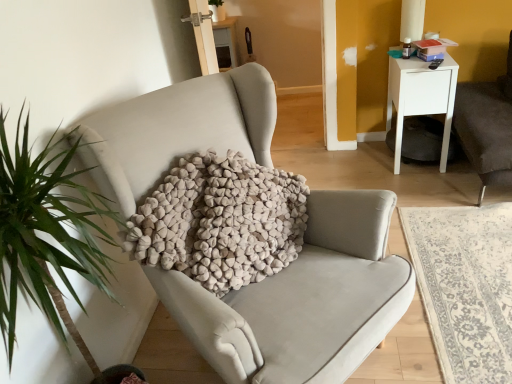
Where is `vacant space positioned to the left of white glossy nightstand at upper right`? The width and height of the screenshot is (512, 384). vacant space positioned to the left of white glossy nightstand at upper right is located at coordinates (355, 163).